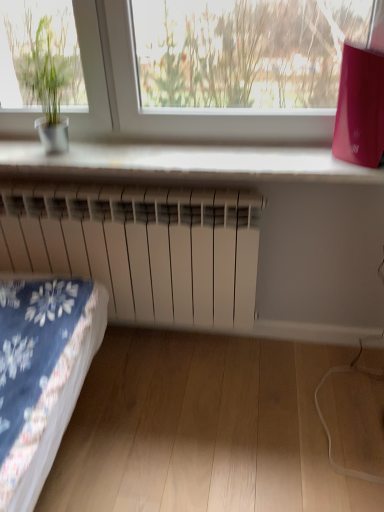
What do you see at coordinates (48, 79) in the screenshot? I see `green matte plant pot at left` at bounding box center [48, 79].

I want to click on green matte plant pot at left, so click(48, 79).

What are the coordinates of `white matte radiator at center` in the screenshot? It's located at (142, 249).

Identify the location of white plastic radiator at lower center. The width and height of the screenshot is (384, 512). (180, 164).

Image resolution: width=384 pixels, height=512 pixels. I want to click on green matte plant pot at left, so [x=48, y=79].

Which object is further away from the camera, white plastic radiator at lower center or white matte radiator at center?

white matte radiator at center.

From the image's perspective, is white plastic radiator at lower center located above or below white matte radiator at center?

white plastic radiator at lower center is situated higher than white matte radiator at center in the image.

Do you think white plastic radiator at lower center is within white matte radiator at center, or outside of it?

white plastic radiator at lower center cannot be found inside white matte radiator at center.

Is white plastic radiator at lower center to the left or to the right of white matte radiator at center in the image?

From the image, it's evident that white plastic radiator at lower center is to the right of white matte radiator at center.

Considering the positions of objects white matte radiator at center and green matte plant pot at left in the image provided, who is in front, white matte radiator at center or green matte plant pot at left?

green matte plant pot at left is in front.

Locate an element on the screen. This screenshot has height=512, width=384. radiator that is on the right side of green matte plant pot at left is located at coordinates (142, 249).

Consider the image. Who is smaller, white matte radiator at center or green matte plant pot at left?

With smaller size is green matte plant pot at left.

Which object is positioned more to the right, white matte radiator at center or green matte plant pot at left?

Positioned to the right is white matte radiator at center.

Is the position of green matte plant pot at left less distant than that of white plastic radiator at lower center?

Yes.

From a real-world perspective, is green matte plant pot at left positioned above or below white plastic radiator at lower center?

green matte plant pot at left is above white plastic radiator at lower center.

Considering the sizes of objects green matte plant pot at left and white plastic radiator at lower center in the image provided, who is thinner, green matte plant pot at left or white plastic radiator at lower center?

green matte plant pot at left is thinner.

Does green matte plant pot at left have a lesser height compared to white plastic radiator at lower center?

No, green matte plant pot at left is not shorter than white plastic radiator at lower center.

From the image's perspective, is green matte plant pot at left on top of white matte radiator at center?

Yes.

Can you confirm if green matte plant pot at left is wider than white matte radiator at center?

Indeed, green matte plant pot at left has a greater width compared to white matte radiator at center.

Can you confirm if green matte plant pot at left is smaller than white matte radiator at center?

Yes.

Does point (38, 29) appear closer or farther from the camera than point (142, 251)?

Point (38, 29) is positioned closer to the camera compared to point (142, 251).

From the picture: Considering the sizes of objects white plastic radiator at lower center and green matte plant pot at left in the image provided, who is shorter, white plastic radiator at lower center or green matte plant pot at left?

white plastic radiator at lower center is shorter.

Considering the positions of objects white plastic radiator at lower center and green matte plant pot at left in the image provided, who is in front, white plastic radiator at lower center or green matte plant pot at left?

green matte plant pot at left.

Is white plastic radiator at lower center beside green matte plant pot at left?

No, white plastic radiator at lower center is not touching green matte plant pot at left.

Is green matte plant pot at left completely or partially inside white plastic radiator at lower center?

No.

Is white matte radiator at center next to white plastic radiator at lower center and touching it?

They are not placed beside each other.

What's the angular difference between white matte radiator at center and white plastic radiator at lower center's facing directions?

The facing directions of white matte radiator at center and white plastic radiator at lower center are 0.681 degrees apart.

In order to click on window sill in front of the white matte radiator at center in this screenshot , I will do `click(180, 164)`.

Which point is more forward, (210, 225) or (371, 172)?

The point (371, 172) is closer.

The height and width of the screenshot is (512, 384). Identify the location of radiator behind the white plastic radiator at lower center. (142, 249).

There is a white matte radiator at center. Where is `houseplant above it (from a real-world perspective)`? The height and width of the screenshot is (512, 384). houseplant above it (from a real-world perspective) is located at coordinates (48, 79).

Estimate the real-world distances between objects in this image. Which object is further from white matte radiator at center, green matte plant pot at left or white plastic radiator at lower center?

The object further to white matte radiator at center is green matte plant pot at left.

From the image, which object appears to be farther from white plastic radiator at lower center, green matte plant pot at left or white matte radiator at center?

Based on the image, green matte plant pot at left appears to be further to white plastic radiator at lower center.

Based on their spatial positions, is white matte radiator at center or white plastic radiator at lower center closer to green matte plant pot at left?

Based on the image, white plastic radiator at lower center appears to be nearer to green matte plant pot at left.

Based on their spatial positions, is white plastic radiator at lower center or green matte plant pot at left closer to white matte radiator at center?

The object closer to white matte radiator at center is white plastic radiator at lower center.

From the picture: Estimate the real-world distances between objects in this image. Which object is further from white plastic radiator at lower center, white matte radiator at center or green matte plant pot at left?

green matte plant pot at left is further to white plastic radiator at lower center.

From the image, which object appears to be farther from green matte plant pot at left, white plastic radiator at lower center or white matte radiator at center?

white matte radiator at center is further to green matte plant pot at left.

Locate an element on the screen. window sill that lies between green matte plant pot at left and white matte radiator at center from top to bottom is located at coordinates click(180, 164).